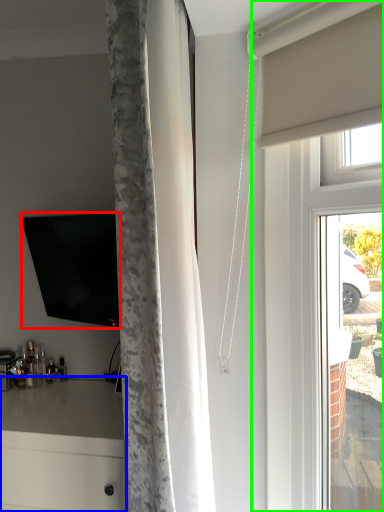
Question: Which object is the closest to the television (highlighted by a red box)? Choose among these: counter (highlighted by a blue box) or glass door (highlighted by a green box).

Choices:
 (A) counter
 (B) glass door

Answer: (A)